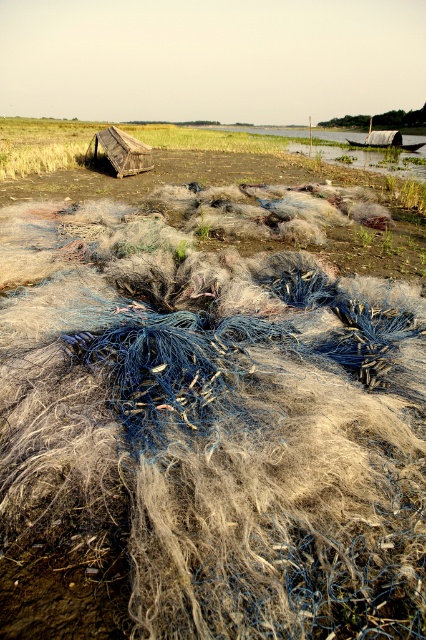
Question: Which object is closer to the camera taking this photo?

Choices:
 (A) rustic wooden hut at center
 (B) fuzzy blue net at center

Answer: (B)

Question: Is fuzzy blue net at center above rustic wooden hut at center?

Choices:
 (A) yes
 (B) no

Answer: (B)

Question: Is the position of fuzzy blue net at center more distant than that of rustic wooden hut at center?

Choices:
 (A) no
 (B) yes

Answer: (A)

Question: Which object is farther from the camera taking this photo?

Choices:
 (A) fuzzy blue net at center
 (B) rustic wooden hut at center

Answer: (B)

Question: Which of the following is the farthest from the observer?

Choices:
 (A) (x=367, y=292)
 (B) (x=126, y=145)

Answer: (B)

Question: Does fuzzy blue net at center have a smaller size compared to rustic wooden hut at center?

Choices:
 (A) yes
 (B) no

Answer: (A)